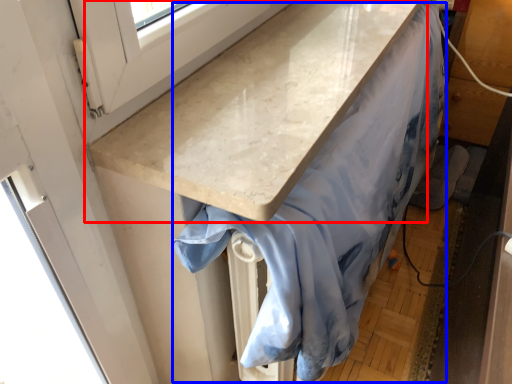
Question: Which object is further to the camera taking this photo, countertop (highlighted by a red box) or fabric (highlighted by a blue box)?

Choices:
 (A) countertop
 (B) fabric

Answer: (B)